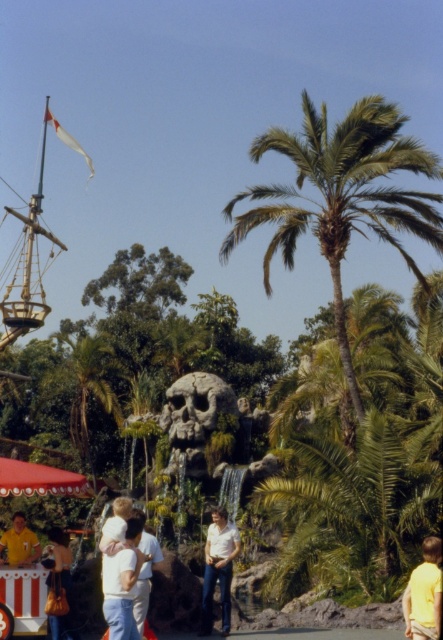
Consider the image. Is the position of yellow matte shirt at lower right less distant than that of matte white shirt at lower left?

Yes.

Is point (431, 547) closer to viewer compared to point (72, 605)?

Yes.

Identify the location of yellow matte shirt at lower right. (423, 593).

Locate an element on the screen. yellow matte shirt at lower right is located at coordinates (423, 593).

Does white cotton shirt at lower left have a smaller size compared to yellow matte shirt at lower right?

Incorrect, white cotton shirt at lower left is not smaller in size than yellow matte shirt at lower right.

Does white cotton shirt at lower left come in front of yellow matte shirt at lower right?

Yes.

Who is more distant from viewer, (124,621) or (440,586)?

Point (440,586)

Locate an element on the screen. Image resolution: width=443 pixels, height=640 pixels. white cotton shirt at lower left is located at coordinates (121, 579).

Which is more to the left, matte white shirt at lower left or yellow matte shirt at lower left?

Positioned to the left is yellow matte shirt at lower left.

Does point (42, 561) come in front of point (15, 516)?

Yes, point (42, 561) is in front of point (15, 516).

At what (x,y) coordinates should I click in order to perform the action: click on matte white shirt at lower left. Please return your answer as a coordinate pair (x, y). The height and width of the screenshot is (640, 443). Looking at the image, I should click on (59, 582).